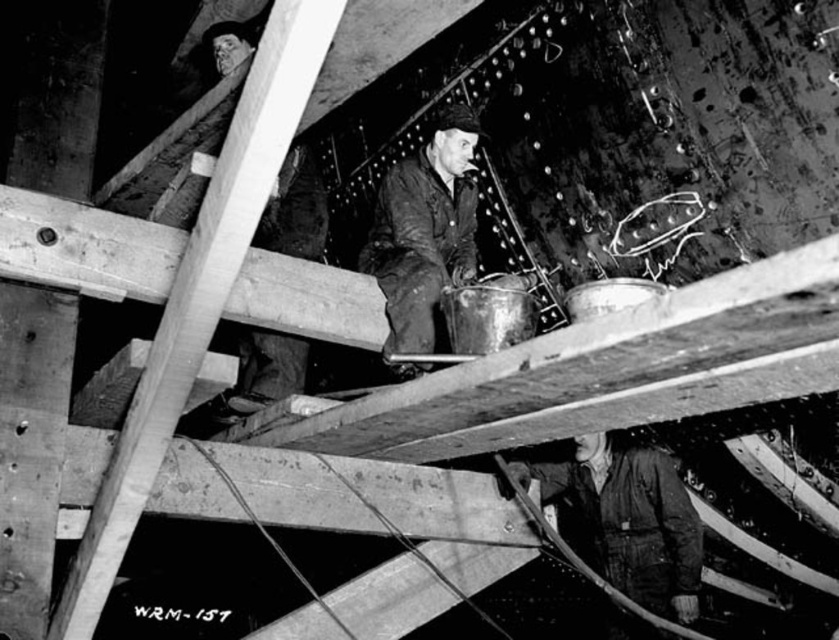
Question: Which object is closer to the camera taking this photo?

Choices:
 (A) dark brown leather jacket at center
 (B) dark gray fabric jacket at lower right

Answer: (A)

Question: Is dark gray fabric jacket at lower right wider than dark brown leather jacket at center?

Choices:
 (A) yes
 (B) no

Answer: (A)

Question: Is dark gray fabric jacket at lower right closer to camera compared to dark brown leather jacket at center?

Choices:
 (A) no
 (B) yes

Answer: (A)

Question: In this image, where is dark gray fabric jacket at lower right located relative to dark brown leather jacket at center?

Choices:
 (A) left
 (B) right

Answer: (B)

Question: Among these points, which one is farthest from the camera?

Choices:
 (A) (535, 470)
 (B) (414, 227)

Answer: (A)